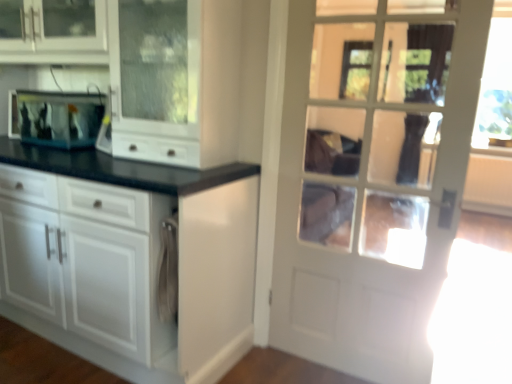
Question: Considering the positions of white glass door at upper right and clear glass fish tank at left in the image, is white glass door at upper right taller or shorter than clear glass fish tank at left?

Choices:
 (A) tall
 (B) short

Answer: (A)

Question: Considering the positions of white glass door at upper right and clear glass fish tank at left in the image, is white glass door at upper right bigger or smaller than clear glass fish tank at left?

Choices:
 (A) big
 (B) small

Answer: (A)

Question: Which object is positioned farthest from the white glossy cabinet at center?

Choices:
 (A) clear glass fish tank at left
 (B) white glass door at upper right

Answer: (A)

Question: Which object is positioned closest to the white glossy cabinet at center?

Choices:
 (A) clear glass fish tank at left
 (B) white glass door at upper right

Answer: (B)